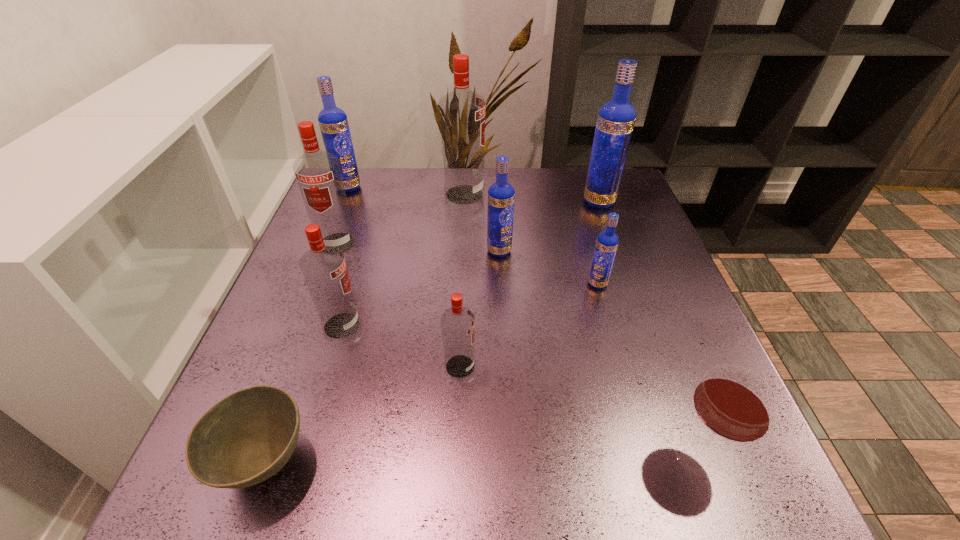
Find the location of `object located at the near left corner`. object located at the near left corner is located at coordinates (247, 437).

The height and width of the screenshot is (540, 960). What are the coordinates of `object that is at the far right corner` in the screenshot? It's located at (616, 118).

Where is `object that is at the near right corner`? object that is at the near right corner is located at coordinates (734, 403).

You are a GUI agent. You are given a task and a screenshot of the screen. Output one action in this format:
    pyautogui.click(x=<x>, y=<y>)
    Task: Click on the vacant area at the far edge
    The image size is (960, 540).
    Given the screenshot: What is the action you would take?
    pyautogui.click(x=553, y=192)

In the image, there is a desktop. Identify the location of free space at the near edge. (592, 482).

At what (x,y) coordinates should I click in order to perform the action: click on vacant area at the left edge of the desktop. Please return your answer as a coordinate pair (x, y). This screenshot has height=540, width=960. Looking at the image, I should click on (280, 328).

Locate an element on the screen. This screenshot has width=960, height=540. free space at the right edge of the desktop is located at coordinates pos(685,375).

Identify the location of free space at the far right corner of the desktop. (625, 183).

Locate an element on the screen. This screenshot has height=540, width=960. unoccupied position between the bowl and the farthest red vodka is located at coordinates (365, 328).

Where is `unoccupied area between the rightmost blue vodka and the farthest red vodka`? unoccupied area between the rightmost blue vodka and the farthest red vodka is located at coordinates (532, 198).